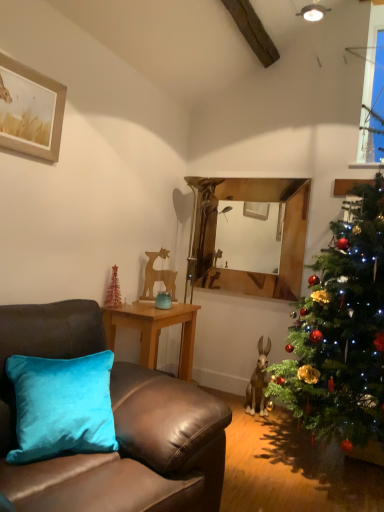
The width and height of the screenshot is (384, 512). Describe the element at coordinates (30, 110) in the screenshot. I see `wooden picture frame at upper left` at that location.

The width and height of the screenshot is (384, 512). Describe the element at coordinates (341, 332) in the screenshot. I see `green matte christmas tree at right` at that location.

Find the location of a particular element. green matte christmas tree at right is located at coordinates (341, 332).

What is the approximate height of woodenobject at center?

26.98 inches.

Identify the location of wooden picture frame at upper left. (30, 110).

Locate an element on the screen. This screenshot has width=384, height=512. studio couch in front of the metallic gold christmas tree at lower left is located at coordinates (115, 426).

In the scene shown: Is the position of velvet brown couch at left more distant than that of metallic gold christmas tree at lower left?

No, the depth of velvet brown couch at left is less than that of metallic gold christmas tree at lower left.

How much distance is there between velvet brown couch at left and metallic gold christmas tree at lower left?

velvet brown couch at left is 4.37 feet from metallic gold christmas tree at lower left.

Would you say woodenobject at center is outside teal velvet vase at center?

woodenobject at center lies outside teal velvet vase at center's area.

From the image's perspective, between woodenobject at center and teal velvet vase at center, who is located below?

woodenobject at center is shown below in the image.

Considering the sizes of woodenobject at center and teal velvet vase at center in the image, is woodenobject at center wider or thinner than teal velvet vase at center?

In the image, woodenobject at center appears to be wider than teal velvet vase at center.

From the picture: From a real-world perspective, between velvet brown couch at left and green matte christmas tree at right, who is vertically lower?

In real-world perspective, velvet brown couch at left is lower.

Does velvet brown couch at left contain green matte christmas tree at right?

No.

Which of these two, velvet brown couch at left or green matte christmas tree at right, stands shorter?

With less height is velvet brown couch at left.

Could you measure the distance between green matte christmas tree at right and metallic gold christmas tree at lower left?

The distance of green matte christmas tree at right from metallic gold christmas tree at lower left is 1.50 meters.

Who is smaller, green matte christmas tree at right or metallic gold christmas tree at lower left?

metallic gold christmas tree at lower left is smaller.

Between green matte christmas tree at right and metallic gold christmas tree at lower left, which one has larger width?

With larger width is green matte christmas tree at right.

Which point is more forward, (337,430) or (118,286)?

The point (337,430) is in front.

Who is more distant, teal velvet vase at center or velvet brown couch at left?

teal velvet vase at center is further from the camera.

What's the angular difference between teal velvet vase at center and velvet brown couch at left's facing directions?

12.6 degrees.

Is teal velvet vase at center wider or thinner than velvet brown couch at left?

Considering their sizes, teal velvet vase at center looks slimmer than velvet brown couch at left.

Looking at this image, is metallic gold christmas tree at lower left inside or outside of green matte christmas tree at right?

metallic gold christmas tree at lower left is not inside green matte christmas tree at right, it's outside.

Between metallic gold christmas tree at lower left and green matte christmas tree at right, which one appears on the right side from the viewer's perspective?

Positioned to the right is green matte christmas tree at right.

Find the location of a particular element. Image resolution: width=384 pixels, height=512 pixels. christmas decoration behind the green matte christmas tree at right is located at coordinates (113, 290).

Is metallic gold christmas tree at lower left bigger than green matte christmas tree at right?

Actually, metallic gold christmas tree at lower left might be smaller than green matte christmas tree at right.

Is green matte christmas tree at right to the left of woodenobject at center from the viewer's perspective?

No.

Does green matte christmas tree at right contain woodenobject at center?

Actually, woodenobject at center is outside green matte christmas tree at right.

Does point (345, 344) come behind point (157, 314)?

No, it is not.

Between green matte christmas tree at right and woodenobject at center, which one has less height?

woodenobject at center is shorter.

Identify the location of christmas decoration lying on the left of velvet brown couch at left. (113, 290).

I want to click on teal that appears on the right of woodenobject at center, so click(x=163, y=300).

When comparing their distances from clear glass window at upper right, does metallic gold christmas tree at lower left or velvet brown couch at left seem closer?

The object closer to clear glass window at upper right is metallic gold christmas tree at lower left.

From the picture: Based on their spatial positions, is velvet brown couch at left or wooden picture frame at upper left closer to clear glass window at upper right?

wooden picture frame at upper left lies closer to clear glass window at upper right than the other object.

Looking at this image, looking at the image, which one is located closer to woodenobject at center, velvet brown couch at left or clear glass window at upper right?

velvet brown couch at left is closer to woodenobject at center.

Which object lies further to the anchor point wooden picture frame at upper left, woodenobject at center or clear glass window at upper right?

The object further to wooden picture frame at upper left is clear glass window at upper right.

Which object lies further to the anchor point metallic gold christmas tree at lower left, green matte christmas tree at right or woodenobject at center?

green matte christmas tree at right.

Estimate the real-world distances between objects in this image. Which object is closer to metallic gold christmas tree at lower left, teal velvet vase at center or wooden picture frame at upper left?

teal velvet vase at center is closer to metallic gold christmas tree at lower left.

Looking at the image, which one is located closer to woodenobject at center, wooden picture frame at upper left or teal velvet vase at center?

The object closer to woodenobject at center is teal velvet vase at center.

From the image, which object appears to be farther from teal velvet vase at center, woodenobject at center or velvet brown couch at left?

velvet brown couch at left lies further to teal velvet vase at center than the other object.

Locate an element on the screen. Image resolution: width=384 pixels, height=512 pixels. teal that lies between metallic gold christmas tree at lower left and woodenobject at center from top to bottom is located at coordinates (163, 300).

The width and height of the screenshot is (384, 512). I want to click on table situated between wooden picture frame at upper left and green matte christmas tree at right from left to right, so click(154, 330).

Locate an element on the screen. The height and width of the screenshot is (512, 384). table between wooden picture frame at upper left and clear glass window at upper right from left to right is located at coordinates (154, 330).

Where is `picture frame positioned between velvet brown couch at left and teal velvet vase at center from near to far`? This screenshot has height=512, width=384. picture frame positioned between velvet brown couch at left and teal velvet vase at center from near to far is located at coordinates (30, 110).